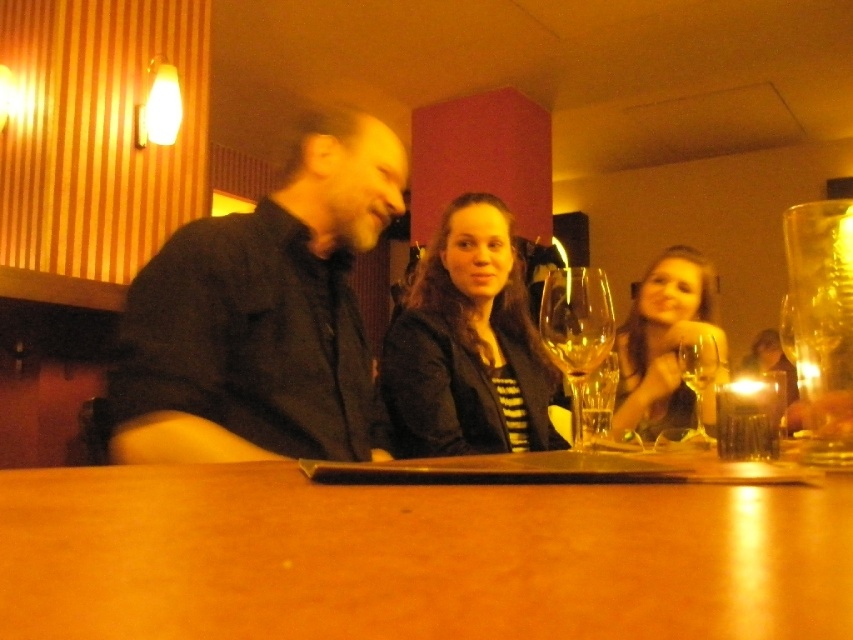
You are a waiter who needs to place a new menu between the clear glass wine glass at center and the translucent glass wine at center on the table. Can you fit the menu there if the menu is 4 centimeters wide?

The clear glass wine glass at center and the translucent glass wine at center are 3.71 centimeters apart. Since the menu is 4 centimeters wide, it won generated because the distance between the two glasses is less than the menu width. The menu cannot be placed there.

Looking at this image, you are a server in a restaurant and need to place a new candle on the table. The new candle is the same size as the translucent glass candle at upper right. Is there enough space between the transparent glass wine glass at right and the edge of the table to place the new candle?

The transparent glass wine glass at right is larger than the translucent glass candle at upper right. Since the candle is smaller, there should be sufficient space between the wine glass and the table edge to place the new candle.

You are a server in the restaurant and need to place a new drink order on the table. The customer specified that the drink must be placed to the left of the transparent glass wine glass at right. Where should you place the new drink?

The transparent glass wine glass at right is located at point [698,380], so you should place the new drink to the left of this coordinate to meet the customer request.